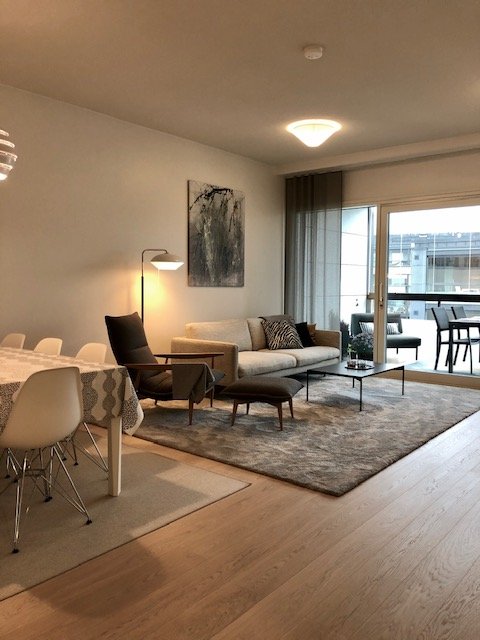
The width and height of the screenshot is (480, 640). What are the coordinates of `black seats in balcony` in the screenshot? It's located at (401, 337), (454, 319), (442, 317).